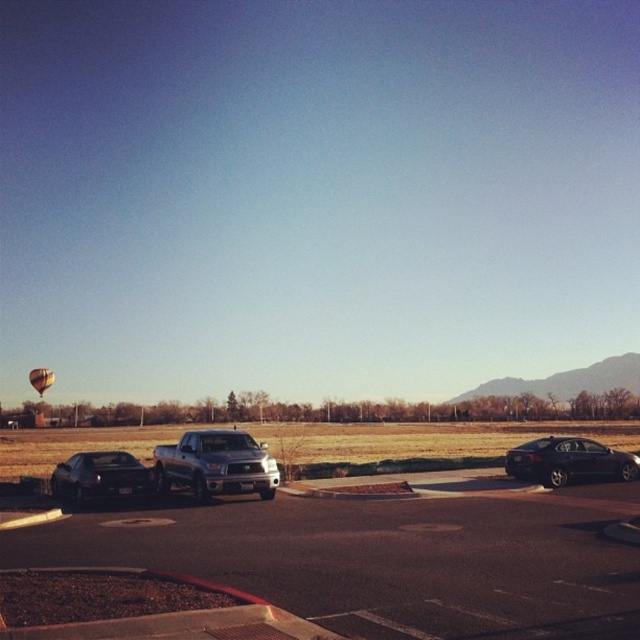
You are a delivery driver who needs to park your truck in the smooth asphalt parking lot at center. Your truck is 15 meters long. Can you safely park your truck there without hitting the yellow fabric balloon at lower left?

The distance between the smooth asphalt parking lot at center and the yellow fabric balloon at lower left is 57.62 meters. Since your truck is only 15 meters long, there is ample space to park safely without hitting the balloon.

You are standing at the point with coordinates point (x=32, y=385) and want to walk towards the point (x=163, y=568). Based on the scene description, will you be walking towards or away from the parking lot?

Point (x=163, y=568) is in front of point (x=32, y=385), so walking towards point (x=163, y=568) would mean you are walking away from the parking lot.